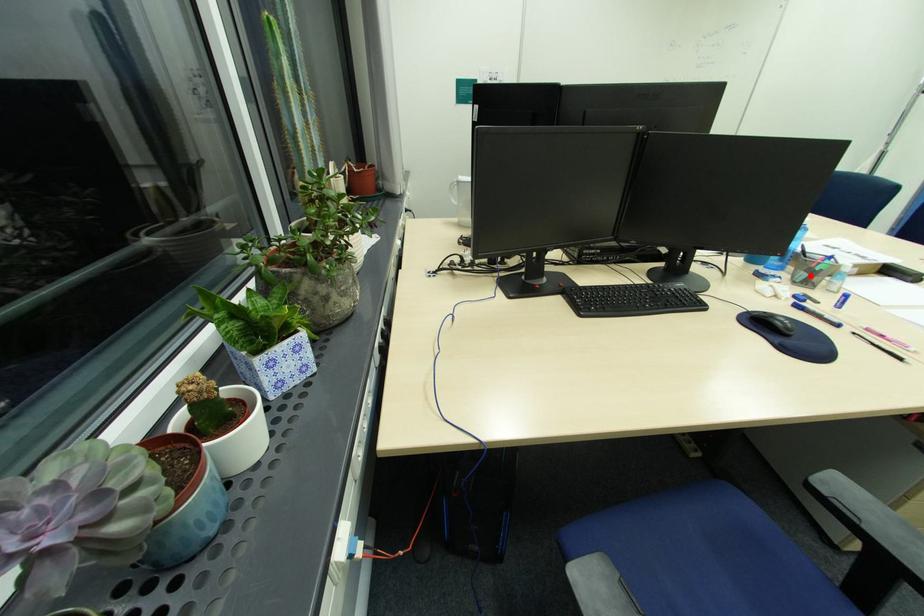
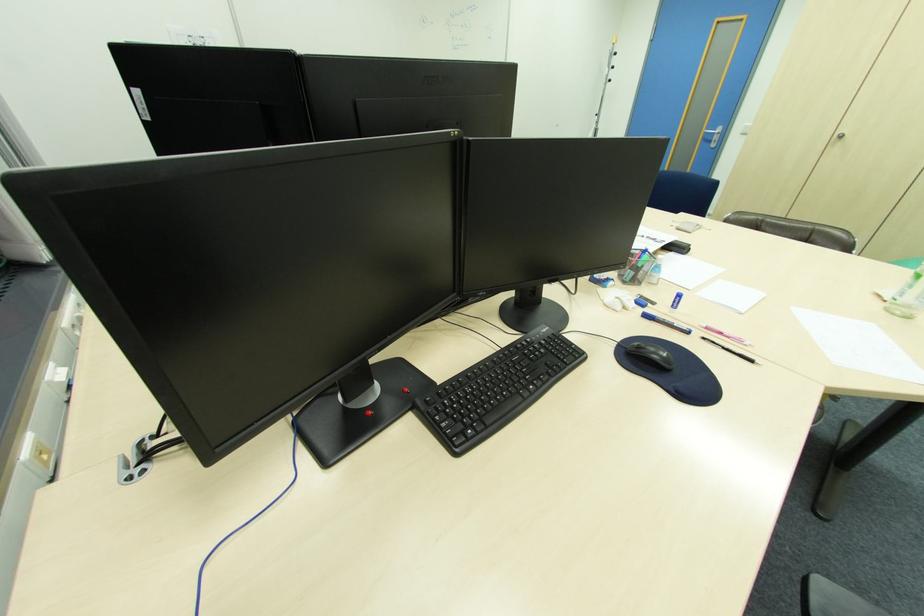
The point at the highlighted location is marked in the first image. Where is the corresponding point in the second image?

(637, 274)